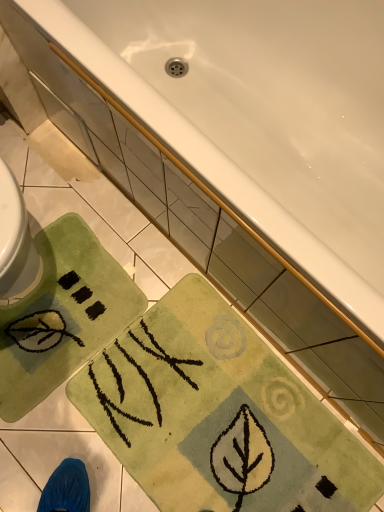
Question: Could you tell me if white glossy bathtub at upper center is facing green soft rug at lower left, positioned as the 1th beach towel in left-to-right order?

Choices:
 (A) yes
 (B) no

Answer: (A)

Question: Is white glossy bathtub at upper center at the left side of green soft rug at lower left, the 2th beach towel from the right?

Choices:
 (A) no
 (B) yes

Answer: (A)

Question: Is white glossy bathtub at upper center touching green soft rug at lower left, the 2th beach towel from the right?

Choices:
 (A) no
 (B) yes

Answer: (A)

Question: Could green soft rug at lower left, positioned as the 1th beach towel in left-to-right order, be considered to be inside white glossy bathtub at upper center?

Choices:
 (A) no
 (B) yes

Answer: (A)

Question: Is white glossy bathtub at upper center positioned far away from green soft rug at lower left, the 2th beach towel from the right?

Choices:
 (A) no
 (B) yes

Answer: (A)

Question: Is green soft rug at lower left, positioned as the 1th beach towel in left-to-right order, taller or shorter than white glossy bathtub at upper center?

Choices:
 (A) tall
 (B) short

Answer: (B)

Question: Is point (62, 252) closer or farther from the camera than point (263, 77)?

Choices:
 (A) farther
 (B) closer

Answer: (A)

Question: From the image's perspective, is green soft rug at lower left, positioned as the 1th beach towel in left-to-right order, above or below white glossy bathtub at upper center?

Choices:
 (A) below
 (B) above

Answer: (A)

Question: Is green soft rug at lower left, the 2th beach towel from the right, to the left or to the right of white glossy bathtub at upper center in the image?

Choices:
 (A) left
 (B) right

Answer: (A)

Question: Is point (203, 348) closer or farther from the camera than point (82, 347)?

Choices:
 (A) farther
 (B) closer

Answer: (A)

Question: Is green soft rug at lower center, placed as the 2th beach towel when sorted from left to right, wider or thinner than green soft rug at lower left, the 2th beach towel from the right?

Choices:
 (A) wide
 (B) thin

Answer: (A)

Question: From the image's perspective, is green soft rug at lower center, the 1th beach towel viewed from the right, positioned above or below green soft rug at lower left, the 2th beach towel from the right?

Choices:
 (A) below
 (B) above

Answer: (A)

Question: Would you say green soft rug at lower center, the 1th beach towel viewed from the right, is to the left or to the right of green soft rug at lower left, the 2th beach towel from the right, in the picture?

Choices:
 (A) left
 (B) right

Answer: (B)

Question: Is green soft rug at lower left, positioned as the 1th beach towel in left-to-right order, situated inside green soft rug at lower center, placed as the 2th beach towel when sorted from left to right, or outside?

Choices:
 (A) outside
 (B) inside

Answer: (A)

Question: From a real-world perspective, is green soft rug at lower left, the 2th beach towel from the right, above or below green soft rug at lower center, placed as the 2th beach towel when sorted from left to right?

Choices:
 (A) below
 (B) above

Answer: (B)